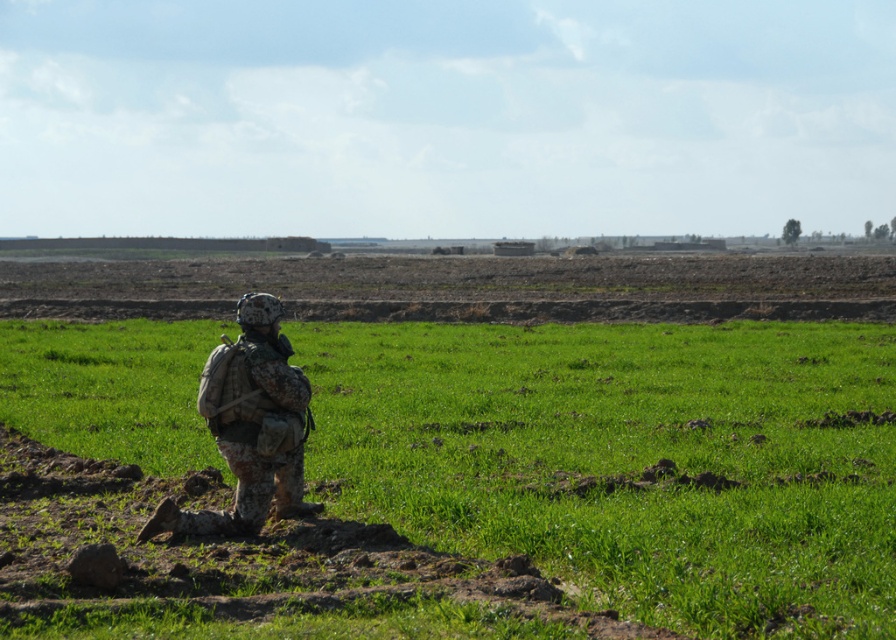
You are a soldier in the field and need to move from your current position to a specific location. Your current position is at point [67,346] and your destination is at point [287,496]. Given the terrain described, which direction should you move to reach your destination?

Since point [67,346] is behind point [287,496], you should move forward to reach your destination.

You are a drone operator observing the open field scene. You notice the camouflage fabric soldier at center and the dull brown soil at center. Which object is closer to the horizon?

The camouflage fabric soldier at center is behind the dull brown soil at center, so the dull brown soil at center is closer to the horizon.